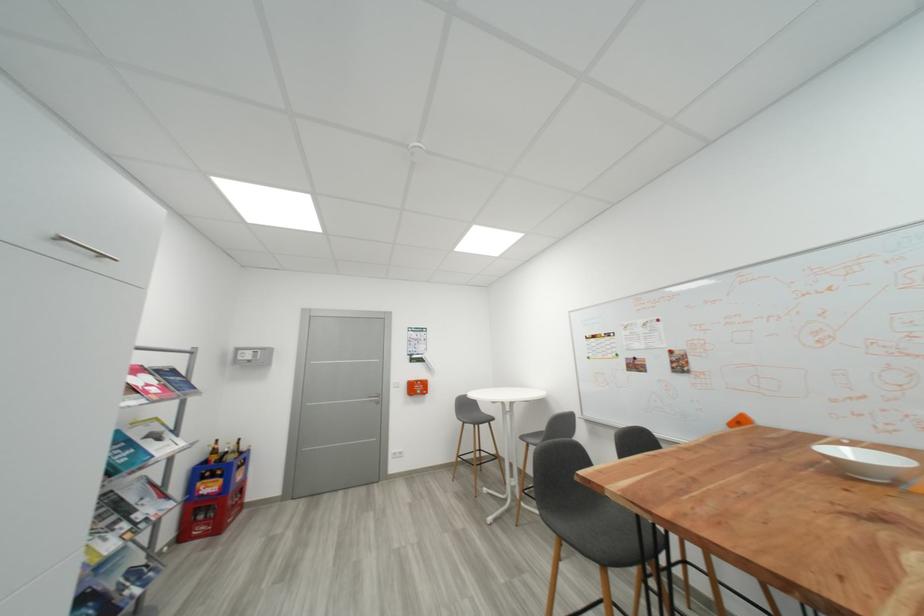
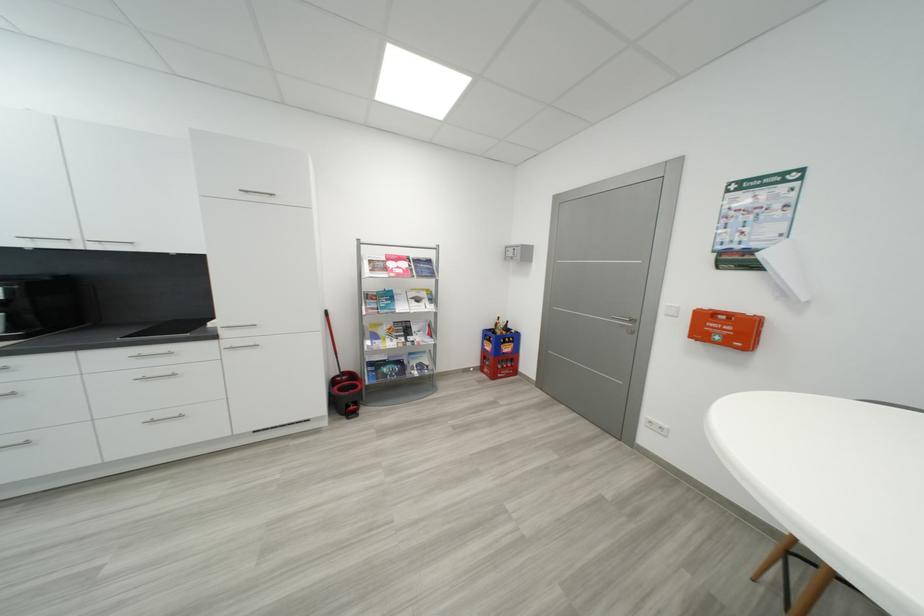
Where in the second image is the point corresponding to [139,499] from the first image?

(421, 330)